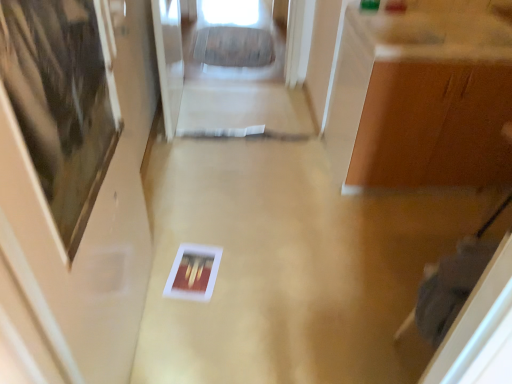
Find the location of `matte wood door at left`. matte wood door at left is located at coordinates (78, 173).

Is matte brown cabinet at upper right facing towards matte wood door at left?

No, matte brown cabinet at upper right does not turn towards matte wood door at left.

Consider the image. Can you confirm if matte brown cabinet at upper right is thinner than matte wood door at left?

In fact, matte brown cabinet at upper right might be wider than matte wood door at left.

Can you tell me how much matte brown cabinet at upper right and matte wood door at left differ in facing direction?

There is a 92.6-degree angle between the facing directions of matte brown cabinet at upper right and matte wood door at left.

From a real-world perspective, which object stands above the other?

From a 3D spatial view, matte wood door at left is above.

Could you tell me if transparent glass door at upper center is facing matte wood door at left?

No.

Can you see transparent glass door at upper center touching matte wood door at left?

No, transparent glass door at upper center is not with matte wood door at left.

Considering the relative sizes of transparent glass door at upper center and matte wood door at left in the image provided, is transparent glass door at upper center bigger than matte wood door at left?

Incorrect, transparent glass door at upper center is not larger than matte wood door at left.

Which is behind, point (116, 56) or point (164, 33)?

Positioned behind is point (164, 33).

From the image's perspective, which is below, matte wood door at left or transparent glass door at upper center?

matte wood door at left appears lower in the image.

Is transparent glass door at upper center inside matte wood door at left?

Definitely not — transparent glass door at upper center is not inside matte wood door at left.

Locate an element on the screen. The image size is (512, 384). door in front of the transparent glass door at upper center is located at coordinates (78, 173).

From the image's perspective, is transparent glass door at upper center under matte brown cabinet at upper right?

No, from the image's perspective, transparent glass door at upper center is not below matte brown cabinet at upper right.

What's the angular difference between transparent glass door at upper center and matte brown cabinet at upper right's facing directions?

There is a 94.3-degree angle between the facing directions of transparent glass door at upper center and matte brown cabinet at upper right.

Based on their positions, is transparent glass door at upper center located to the left or right of matte brown cabinet at upper right?

From the image, it's evident that transparent glass door at upper center is to the left of matte brown cabinet at upper right.

You are a GUI agent. You are given a task and a screenshot of the screen. Output one action in this format:
    pyautogui.click(x=<x>, y=<y>)
    Task: Click on the glass door that is under the matte brown cabinet at upper right (from a real-world perspective)
    Image resolution: width=512 pixels, height=384 pixels.
    Given the screenshot: What is the action you would take?
    pyautogui.click(x=169, y=59)

Can you tell me how much matte brown cabinet at upper right and transparent glass door at upper center differ in facing direction?

94.3 degrees.

From a real-world perspective, which object rests below the other?

transparent glass door at upper center is physically lower.

Which point is more forward, (x=45, y=162) or (x=481, y=102)?

Point (x=45, y=162)

Is matte wood door at left completely or partially outside of matte brown cabinet at upper right?

Indeed, matte wood door at left is completely outside matte brown cabinet at upper right.

Between matte wood door at left and matte brown cabinet at upper right, which one appears on the left side from the viewer's perspective?

matte wood door at left is more to the left.

Is matte wood door at left bigger than matte brown cabinet at upper right?

No, matte wood door at left is not bigger than matte brown cabinet at upper right.

This screenshot has width=512, height=384. In order to click on door below the matte brown cabinet at upper right (from the image's perspective) in this screenshot , I will do `click(78, 173)`.

Locate an element on the screen. glass door below the matte wood door at left (from a real-world perspective) is located at coordinates (169, 59).

When comparing their distances from matte brown cabinet at upper right, does matte wood door at left or transparent glass door at upper center seem further?

Based on the image, transparent glass door at upper center appears to be further to matte brown cabinet at upper right.

Estimate the real-world distances between objects in this image. Which object is closer to transparent glass door at upper center, matte wood door at left or matte brown cabinet at upper right?

matte wood door at left lies closer to transparent glass door at upper center than the other object.

When comparing their distances from transparent glass door at upper center, does matte brown cabinet at upper right or matte wood door at left seem closer?

The object closer to transparent glass door at upper center is matte wood door at left.

Based on their spatial positions, is transparent glass door at upper center or matte brown cabinet at upper right closer to matte wood door at left?

transparent glass door at upper center.

Estimate the real-world distances between objects in this image. Which object is further from matte wood door at left, matte brown cabinet at upper right or transparent glass door at upper center?

matte brown cabinet at upper right.

Estimate the real-world distances between objects in this image. Which object is closer to matte brown cabinet at upper right, transparent glass door at upper center or matte wood door at left?

Among the two, matte wood door at left is located nearer to matte brown cabinet at upper right.

Image resolution: width=512 pixels, height=384 pixels. Find the location of `cabinetry between matte wood door at left and transparent glass door at upper center from front to back`. cabinetry between matte wood door at left and transparent glass door at upper center from front to back is located at coordinates (434, 98).